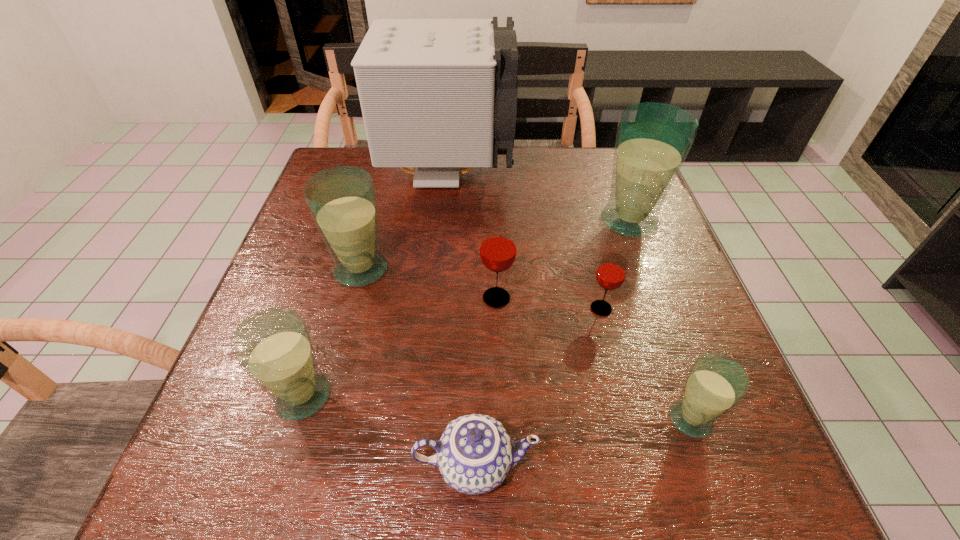
Locate an element on the screen. blank region between the shortest object and the third smallest blue glass is located at coordinates (418, 367).

The width and height of the screenshot is (960, 540). In order to click on unoccupied position between the left red glass and the tallest object in this screenshot , I will do `click(472, 236)`.

Locate an element on the screen. vacant area that lies between the gray fan and the left red glass is located at coordinates (472, 236).

Locate an element on the screen. This screenshot has width=960, height=540. free space between the smallest blue glass and the fan is located at coordinates (570, 296).

I want to click on empty space that is in between the smallest blue glass and the third glass from left to right, so click(x=593, y=359).

Where is `free area in between the fan and the smallest blue glass`? free area in between the fan and the smallest blue glass is located at coordinates (570, 296).

This screenshot has width=960, height=540. Identify the location of vacant area that lies between the smallest blue glass and the fan. (570, 296).

The width and height of the screenshot is (960, 540). In order to click on free point between the farthest glass and the fan in this screenshot , I will do `click(539, 197)`.

Where is `the third closest object to the tallest object`? The width and height of the screenshot is (960, 540). the third closest object to the tallest object is located at coordinates point(498,248).

Locate an element on the screen. The height and width of the screenshot is (540, 960). object that is the seventh closest to the farthest blue glass is located at coordinates (273, 346).